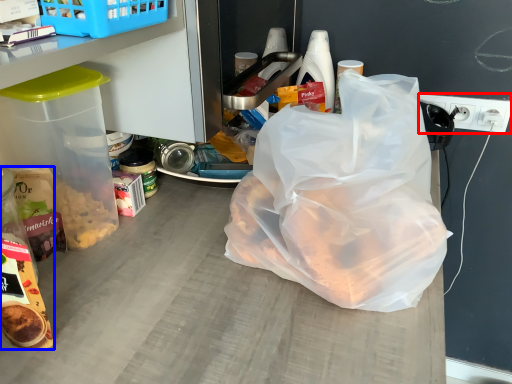
Question: Which point is further to the camera, electric outlet (highlighted by a red box) or snack (highlighted by a blue box)?

Choices:
 (A) electric outlet
 (B) snack

Answer: (A)